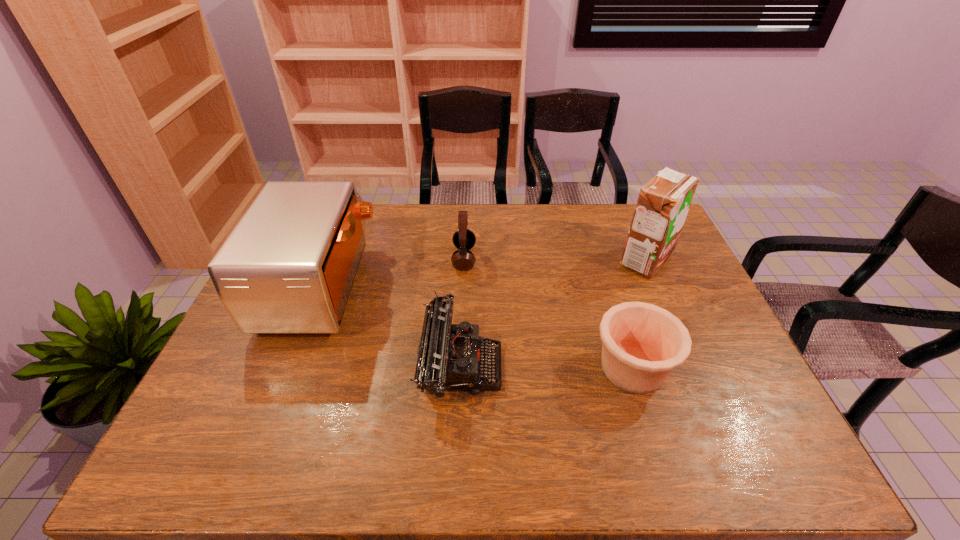
Find the location of a particular element. This screenshot has width=960, height=540. blank region between the headset and the carton is located at coordinates (555, 259).

Find the location of a particular element. Image resolution: width=960 pixels, height=540 pixels. object that is the second closest to the toaster oven is located at coordinates (464, 239).

Locate an element on the screen. This screenshot has width=960, height=540. the fourth closest object to the typewriter is located at coordinates (663, 203).

Identify the location of free spot that satisfies the following two spatial constraints: 1. on the straw side of the carton; 2. on the front side of the pottery. The height and width of the screenshot is (540, 960). (693, 368).

Locate an element on the screen. This screenshot has height=540, width=960. vacant region that satisfies the following two spatial constraints: 1. on the door side of the toaster oven; 2. on the back side of the pottery is located at coordinates (290, 368).

Where is `free space that satisfies the following two spatial constraints: 1. on the ear pads of the pottery; 2. on the left side of the third shortest object`? The height and width of the screenshot is (540, 960). free space that satisfies the following two spatial constraints: 1. on the ear pads of the pottery; 2. on the left side of the third shortest object is located at coordinates (460, 368).

The width and height of the screenshot is (960, 540). Identify the location of free point that satisfies the following two spatial constraints: 1. on the door side of the toaster oven; 2. on the left side of the pottery. (290, 368).

Locate an element on the screen. vacant area in the image that satisfies the following two spatial constraints: 1. on the back side of the pottery; 2. on the ear pads of the headset is located at coordinates tap(598, 259).